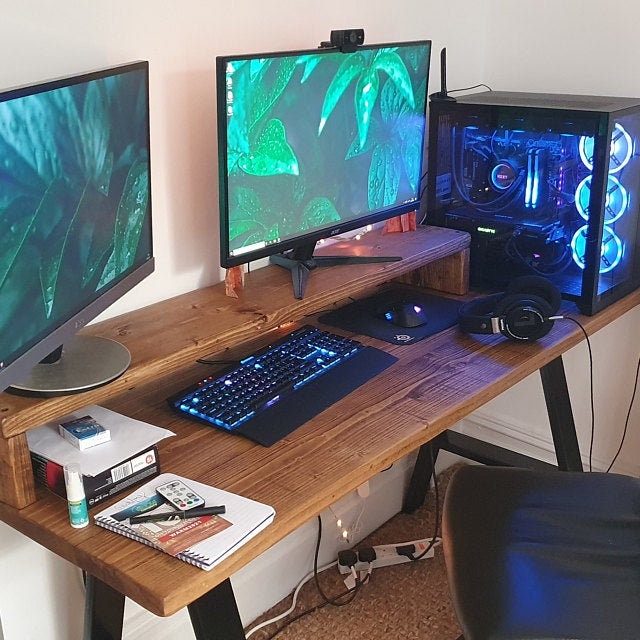
Identify the location of desk. The height and width of the screenshot is (640, 640). (371, 428).